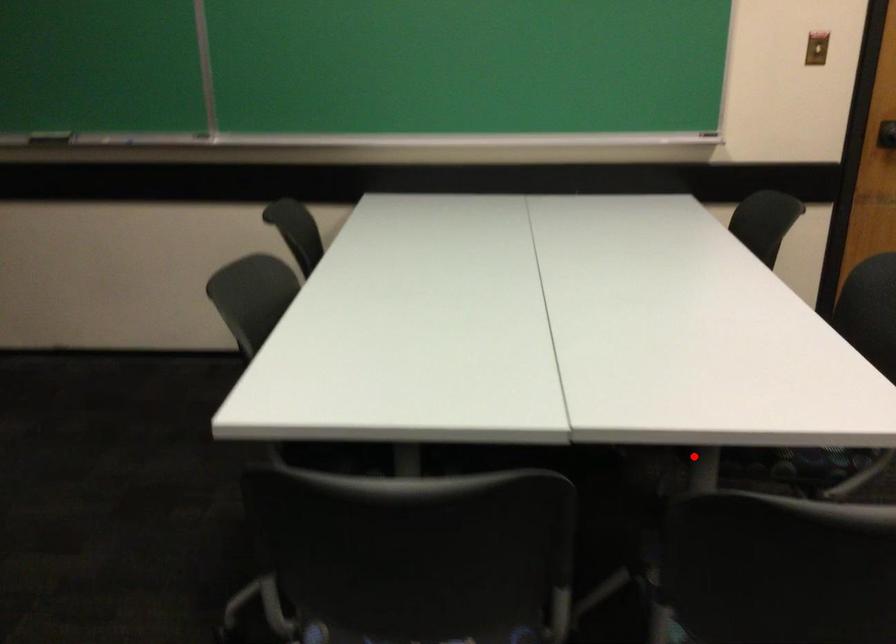
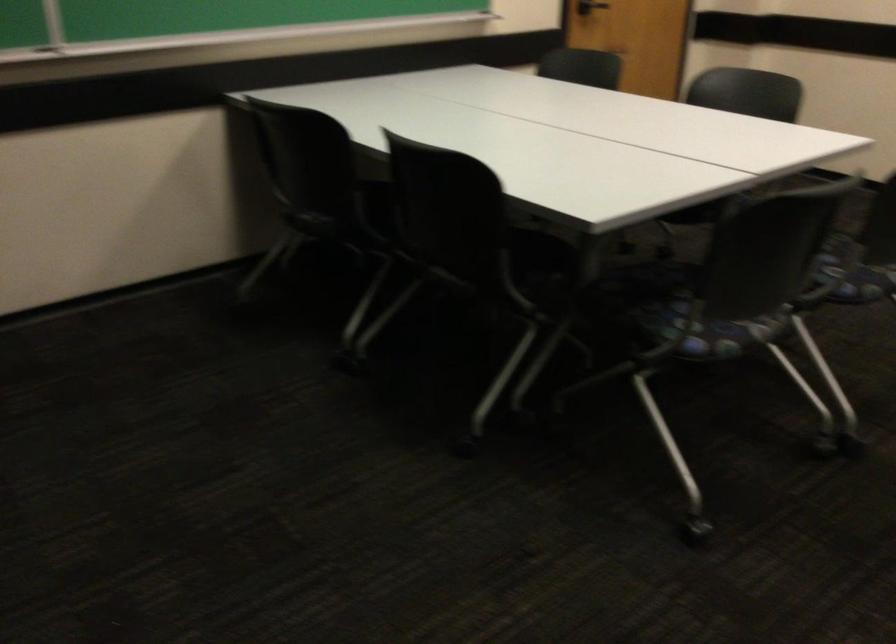
Question: I am providing you with two images of the same scene from different viewpoints. Given a red point in image1, look at the same physical point in image2. Is it:

Choices:
 (A) Closer to the viewpoint
 (B) Farther from the viewpoint

Answer: (B)